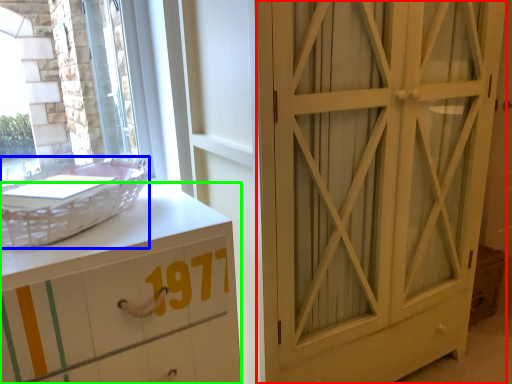
Question: Considering the real-world distances, which object is farthest from door (highlighted by a red box)? basket (highlighted by a blue box) or chest of drawers (highlighted by a green box)?

Choices:
 (A) basket
 (B) chest of drawers

Answer: (A)